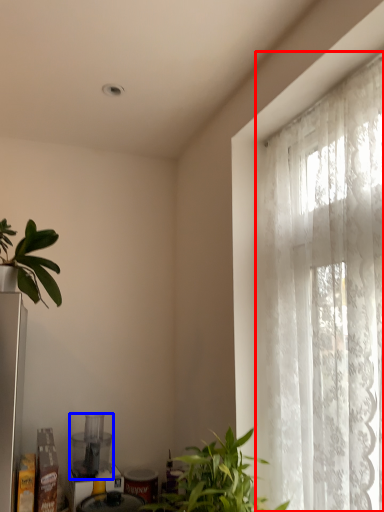
Question: Which object appears closest to the camera in this image, window (highlighted by a red box) or appliance (highlighted by a blue box)?

Choices:
 (A) window
 (B) appliance

Answer: (A)